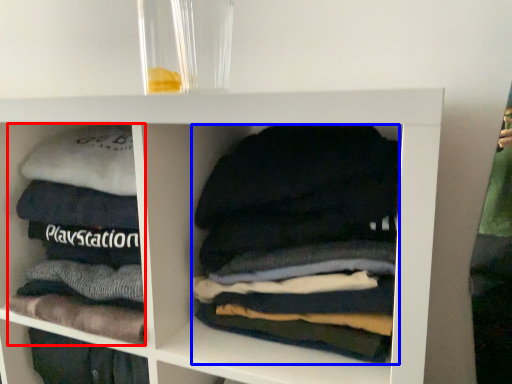
Question: Among these objects, which one is farthest to the camera, material (highlighted by a red box) or laundry (highlighted by a blue box)?

Choices:
 (A) material
 (B) laundry

Answer: (A)